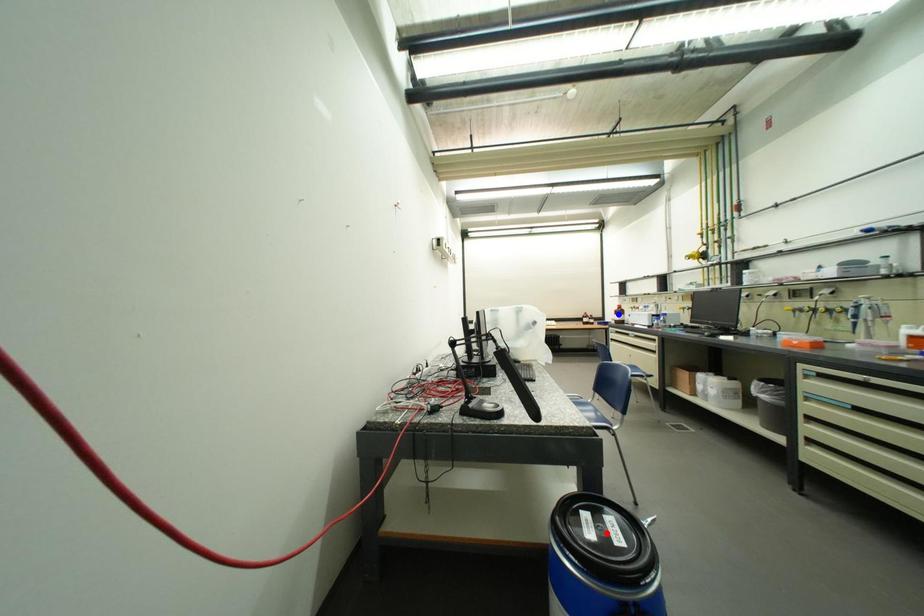
Question: Two points are marked on the image. Which point is closer to the camera?

Choices:
 (A) Blue point is closer.
 (B) Red point is closer.

Answer: (B)